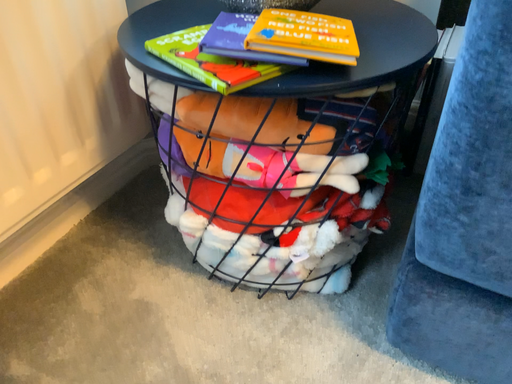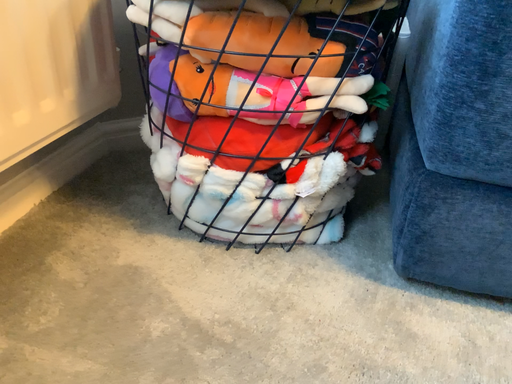
Question: How did the camera likely rotate when shooting the video?

Choices:
 (A) rotated upward
 (B) rotated downward

Answer: (A)